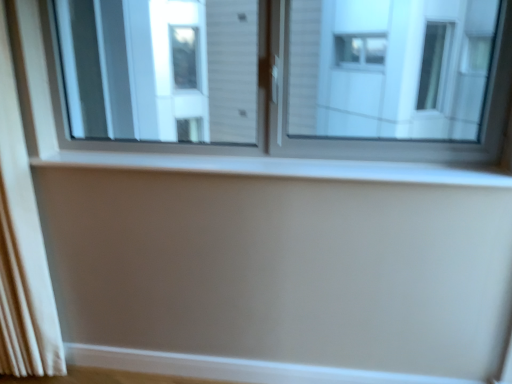
This screenshot has height=384, width=512. I want to click on free space above white smooth window sill at center (from a real-world perspective), so (x=269, y=158).